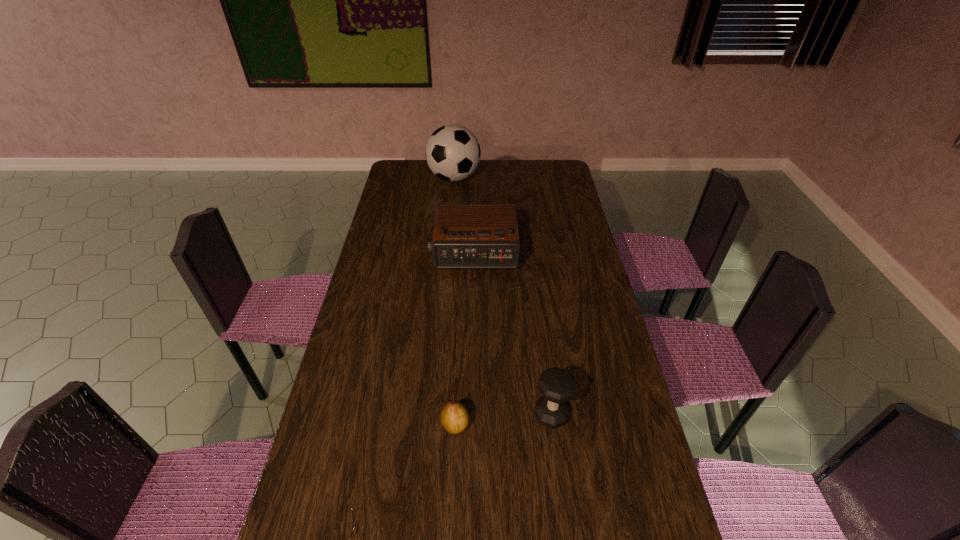
Where is `the third closest object to the pear`? The height and width of the screenshot is (540, 960). the third closest object to the pear is located at coordinates (453, 153).

Identify the location of vacant space that satisfies the following two spatial constraints: 1. on the back side of the shortest object; 2. on the left side of the rightmost object. The height and width of the screenshot is (540, 960). (455, 415).

Where is `vacant space that satisfies the following two spatial constraints: 1. on the front side of the rightmost object; 2. on the right side of the tallest object`? Image resolution: width=960 pixels, height=540 pixels. vacant space that satisfies the following two spatial constraints: 1. on the front side of the rightmost object; 2. on the right side of the tallest object is located at coordinates (435, 415).